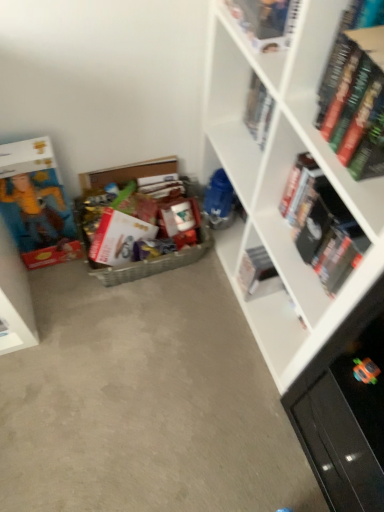
Question: Should I look upward or downward to see hardcover book at upper right, which appears as the sixth book when viewed from the left?

Choices:
 (A) up
 (B) down

Answer: (A)

Question: Is white matte book at center, which is the third book in right-to-left order, outside white matte bookcase at right?

Choices:
 (A) yes
 (B) no

Answer: (B)

Question: Does white matte book at center, the 4th book viewed from the left, turn towards white matte bookcase at right?

Choices:
 (A) yes
 (B) no

Answer: (A)

Question: Is white matte book at center, the 4th book viewed from the left, shorter than white matte bookcase at right?

Choices:
 (A) yes
 (B) no

Answer: (A)

Question: Is white matte book at center, which is the third book in right-to-left order, placed right next to white matte bookcase at right?

Choices:
 (A) no
 (B) yes

Answer: (A)

Question: Does white matte book at center, the 4th book viewed from the left, have a larger size compared to white matte bookcase at right?

Choices:
 (A) no
 (B) yes

Answer: (A)

Question: From the image's perspective, is white matte book at center, which is the third book in right-to-left order, over white matte bookcase at right?

Choices:
 (A) yes
 (B) no

Answer: (B)

Question: Is hardcover book at upper right, which is the 5th book from left to right, aimed at hardcover book at upper center, which ranks as the 5th book in right-to-left order?

Choices:
 (A) no
 (B) yes

Answer: (A)

Question: From the image's perspective, is hardcover book at upper right, which is the second book in right-to-left order, under hardcover book at upper center, which ranks as the 5th book in right-to-left order?

Choices:
 (A) no
 (B) yes

Answer: (B)

Question: Considering the relative sizes of hardcover book at upper right, which is the 5th book from left to right, and hardcover book at upper center, placed as the second book when sorted from left to right, in the image provided, is hardcover book at upper right, which is the 5th book from left to right, taller than hardcover book at upper center, placed as the second book when sorted from left to right,?

Choices:
 (A) no
 (B) yes

Answer: (B)

Question: Is hardcover book at upper right, which is the second book in right-to-left order, at the left side of hardcover book at upper center, which ranks as the 5th book in right-to-left order?

Choices:
 (A) no
 (B) yes

Answer: (A)

Question: Considering the relative sizes of hardcover book at upper right, which is the second book in right-to-left order, and hardcover book at upper center, which ranks as the 5th book in right-to-left order, in the image provided, is hardcover book at upper right, which is the second book in right-to-left order, smaller than hardcover book at upper center, which ranks as the 5th book in right-to-left order,?

Choices:
 (A) yes
 (B) no

Answer: (B)

Question: Is hardcover book at upper right, which is the second book in right-to-left order, positioned behind hardcover book at upper center, which ranks as the 5th book in right-to-left order?

Choices:
 (A) no
 (B) yes

Answer: (B)

Question: Is hardcover book at upper right, which is the 5th book from left to right, shorter than hardcover book at upper right, which appears as the sixth book when viewed from the left?

Choices:
 (A) no
 (B) yes

Answer: (A)